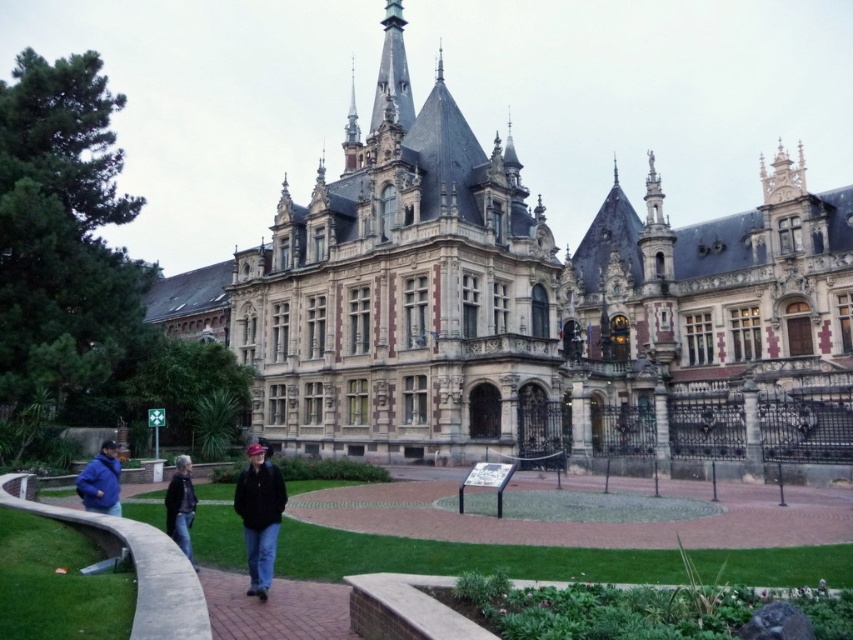
Question: Which point is farther to the camera?

Choices:
 (A) (181, 547)
 (B) (321, 289)

Answer: (B)

Question: Does green grass at lower center have a greater width compared to dark gray jacket at center?

Choices:
 (A) no
 (B) yes

Answer: (B)

Question: Is stone castle at center above blue matte jacket at lower left?

Choices:
 (A) yes
 (B) no

Answer: (A)

Question: Which is nearer to the green grass at lower center?

Choices:
 (A) stone castle at center
 (B) blue matte jacket at lower left
 (C) dark gray jacket at center

Answer: (C)

Question: Which of the following is the closest to the observer?

Choices:
 (A) (171, 513)
 (B) (206, 598)
 (C) (267, 486)

Answer: (B)

Question: Does stone castle at center appear on the right side of blue matte jacket at lower left?

Choices:
 (A) yes
 (B) no

Answer: (A)